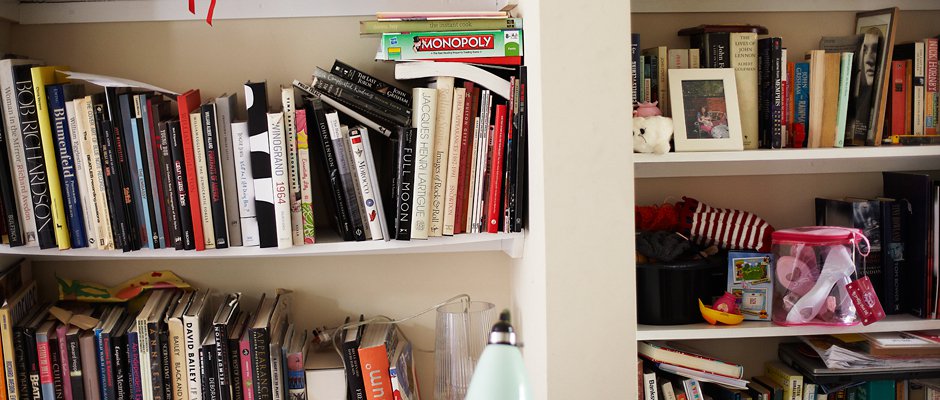
The height and width of the screenshot is (400, 940). Find the location of `blank space between book case`. blank space between book case is located at coordinates (583, 141).